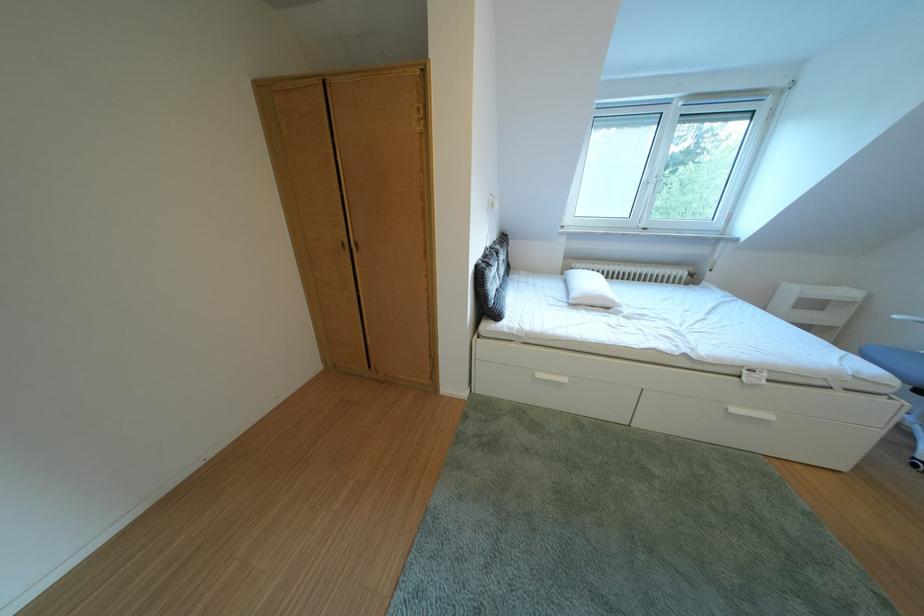
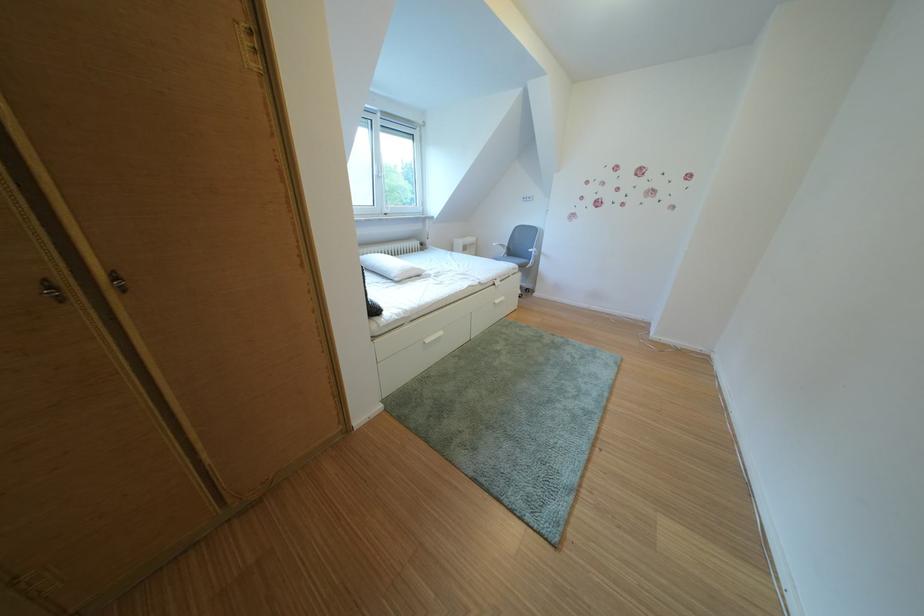
In the second image, find the point that corresponds to (606,272) in the first image.

(380, 256)